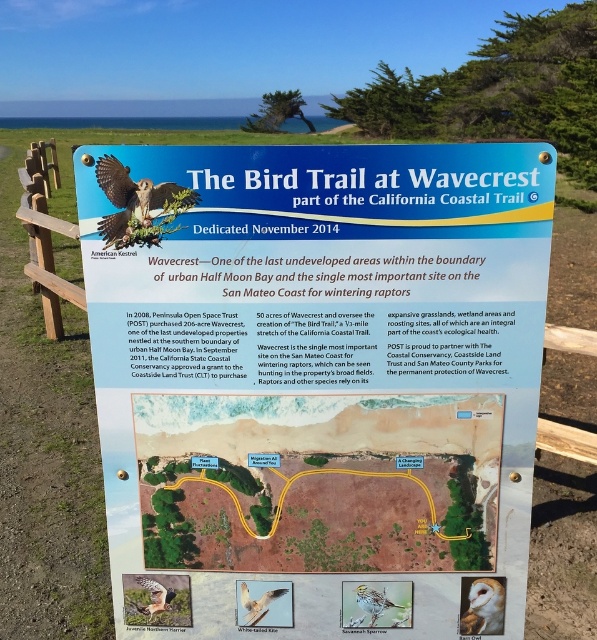
Question: Does white feathered bird at center appear over white speckled feathers at center?

Choices:
 (A) no
 (B) yes

Answer: (A)

Question: Does blue plastic sign at center appear on the right side of matte brown eagle at upper left?

Choices:
 (A) no
 (B) yes

Answer: (B)

Question: Can you confirm if white feathered owl at center is positioned to the right of white speckled feathers at center?

Choices:
 (A) no
 (B) yes

Answer: (B)

Question: Among these points, which one is nearest to the camera?

Choices:
 (A) (173, 595)
 (B) (472, 634)
 (C) (238, 609)

Answer: (B)

Question: Which point is farther to the camera?

Choices:
 (A) brown speckled feathers at center
 (B) white speckled feathers at center
 (C) white feathered bird at center

Answer: (B)

Question: Which object is the farthest from the brown speckled feathers at center?

Choices:
 (A) matte brown eagle at upper left
 (B) white feathered bird at center
 (C) white speckled feathers at center
 (D) blue plastic sign at center

Answer: (A)